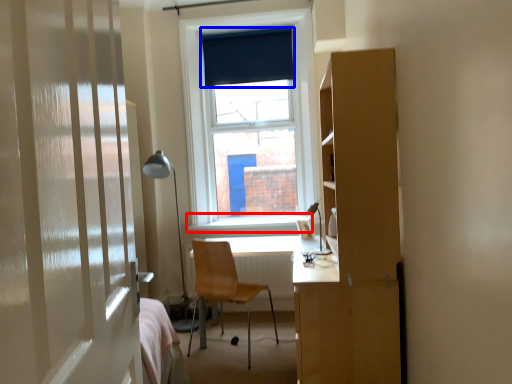
Question: Which of the following is the closest to the observer, window sill (highlighted by a red box) or curtain (highlighted by a blue box)?

Choices:
 (A) window sill
 (B) curtain

Answer: (A)